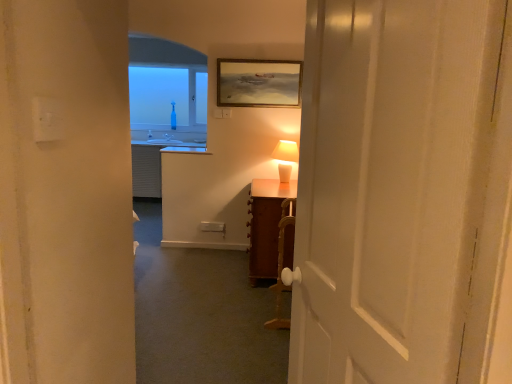
Question: Considering the relative sizes of wooden cabinet at center and white ceramic table lamp at center in the image provided, is wooden cabinet at center taller than white ceramic table lamp at center?

Choices:
 (A) no
 (B) yes

Answer: (B)

Question: Is the depth of wooden cabinet at center greater than that of white ceramic table lamp at center?

Choices:
 (A) no
 (B) yes

Answer: (A)

Question: From the image's perspective, does wooden cabinet at center appear lower than white ceramic table lamp at center?

Choices:
 (A) yes
 (B) no

Answer: (A)

Question: Is wooden cabinet at center at the left side of white ceramic table lamp at center?

Choices:
 (A) yes
 (B) no

Answer: (A)

Question: Is wooden cabinet at center not inside white ceramic table lamp at center?

Choices:
 (A) yes
 (B) no

Answer: (A)

Question: From a real-world perspective, is wooden cabinet at center positioned under white ceramic table lamp at center based on gravity?

Choices:
 (A) yes
 (B) no

Answer: (A)

Question: Considering the relative sizes of wooden cabinet at center and white plastic electric outlet at upper center in the image provided, is wooden cabinet at center shorter than white plastic electric outlet at upper center?

Choices:
 (A) yes
 (B) no

Answer: (B)

Question: Is wooden cabinet at center further to camera compared to white plastic electric outlet at upper center?

Choices:
 (A) yes
 (B) no

Answer: (B)

Question: Can you confirm if wooden cabinet at center is wider than white plastic electric outlet at upper center?

Choices:
 (A) no
 (B) yes

Answer: (B)

Question: Can you confirm if wooden cabinet at center is thinner than white plastic electric outlet at upper center?

Choices:
 (A) yes
 (B) no

Answer: (B)

Question: Is wooden cabinet at center taller than white plastic electric outlet at upper center?

Choices:
 (A) no
 (B) yes

Answer: (B)

Question: Is wooden cabinet at center aimed at white plastic electric outlet at upper center?

Choices:
 (A) no
 (B) yes

Answer: (A)

Question: From a real-world perspective, does white ceramic table lamp at center stand above wooden cabinet at right?

Choices:
 (A) yes
 (B) no

Answer: (A)